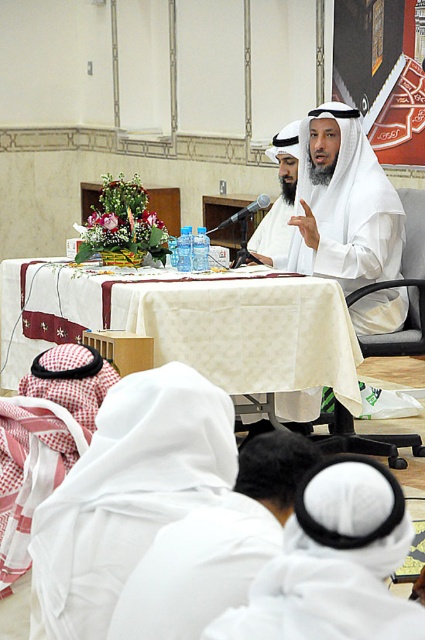
Question: Which point is closer to the camera?

Choices:
 (A) (280, 156)
 (B) (331, 445)

Answer: (B)

Question: Can you confirm if white fabric chair at center is positioned above white matte/soft fabric at center?

Choices:
 (A) no
 (B) yes

Answer: (A)

Question: Can you confirm if white fabric chair at center is positioned below white matte/soft fabric at center?

Choices:
 (A) no
 (B) yes

Answer: (B)

Question: Estimate the real-world distances between objects in this image. Which object is closer to the white cloth at lower center?

Choices:
 (A) white cloth table at center
 (B) white fabric chair at center
 (C) white matte/soft fabric at center
 (D) white matte robe at center

Answer: (A)

Question: Which is nearer to the white fabric chair at center?

Choices:
 (A) white matte robe at center
 (B) white matte/soft fabric at center
 (C) white cloth table at center
 (D) white cloth at lower center

Answer: (A)

Question: Can you confirm if white cloth at lower center is positioned to the left of white fabric chair at center?

Choices:
 (A) yes
 (B) no

Answer: (A)